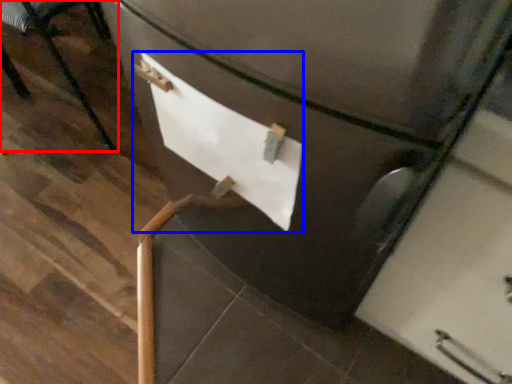
Question: Which point is closer to the camera, furniture (highlighted by a red box) or paper (highlighted by a blue box)?

Choices:
 (A) furniture
 (B) paper

Answer: (B)